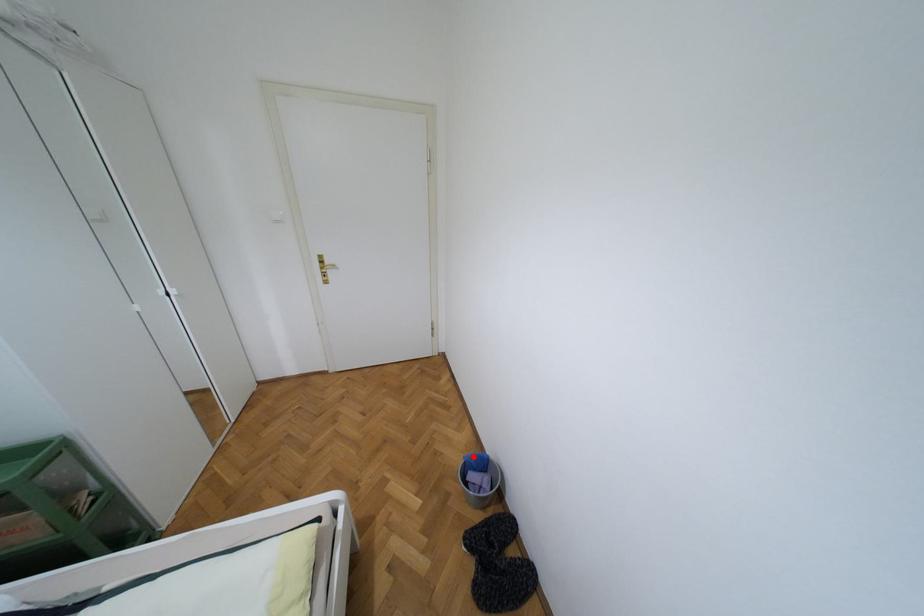
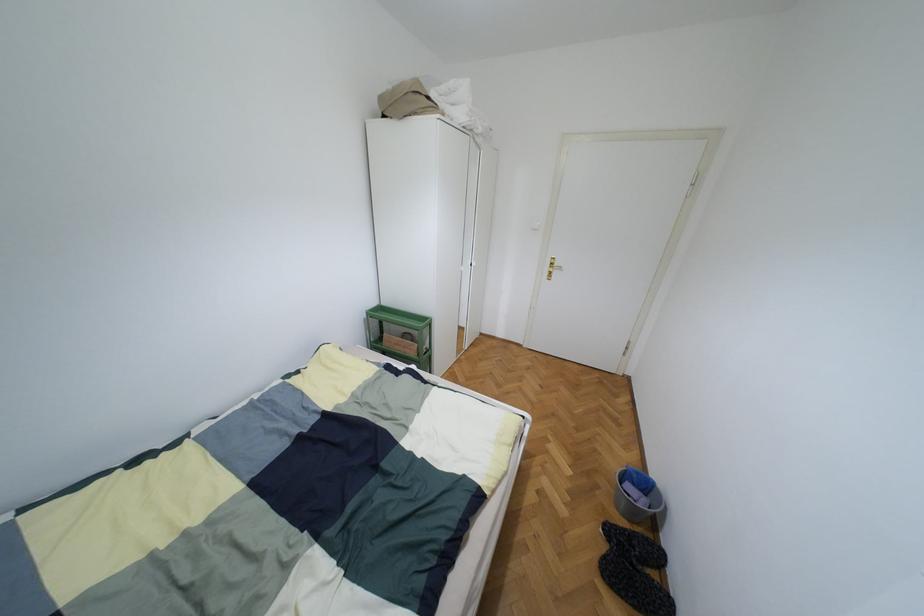
Locate, in the second image, the point that corresponds to the highlighted location in the first image.

(638, 472)